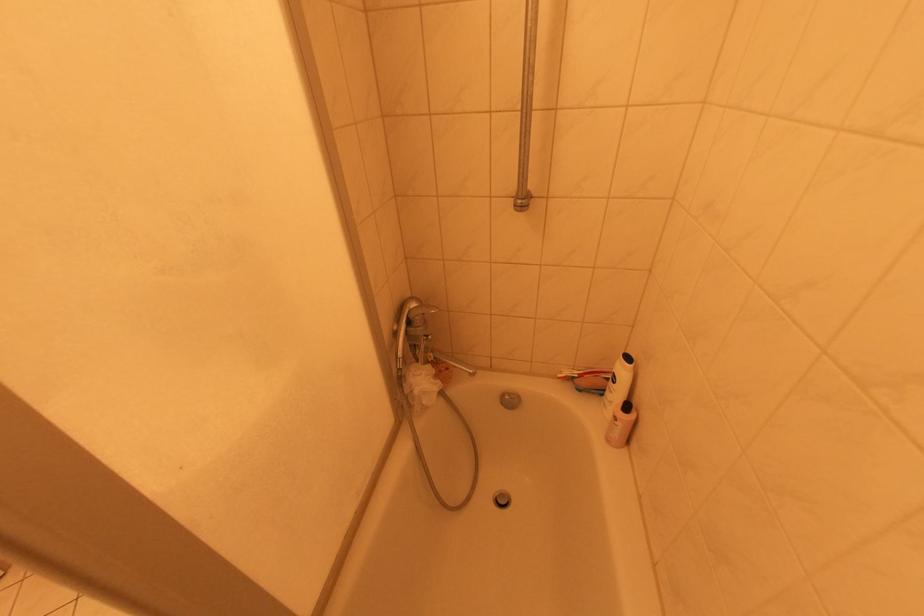
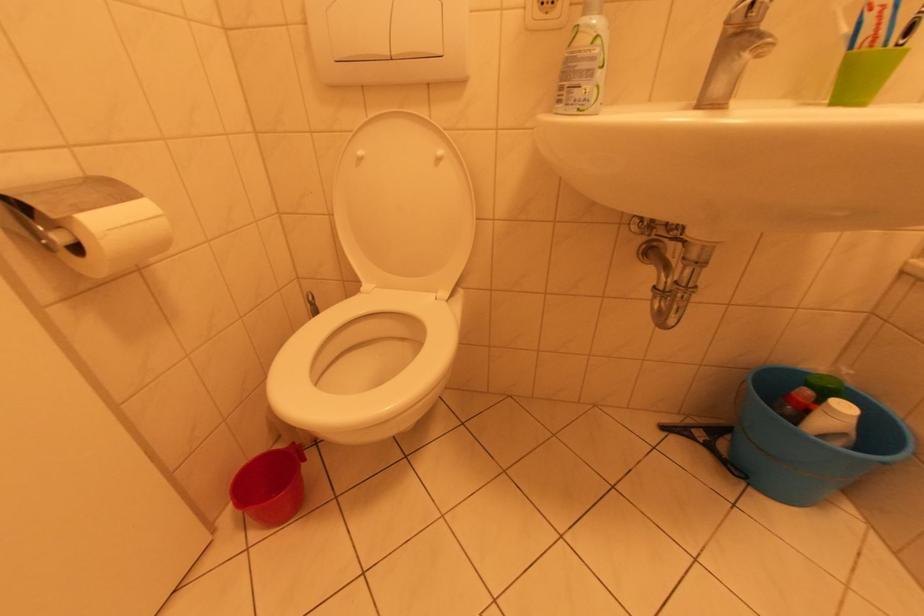
Which direction would the cameraman need to move to produce the second image?

The cameraman walked toward left, forward.